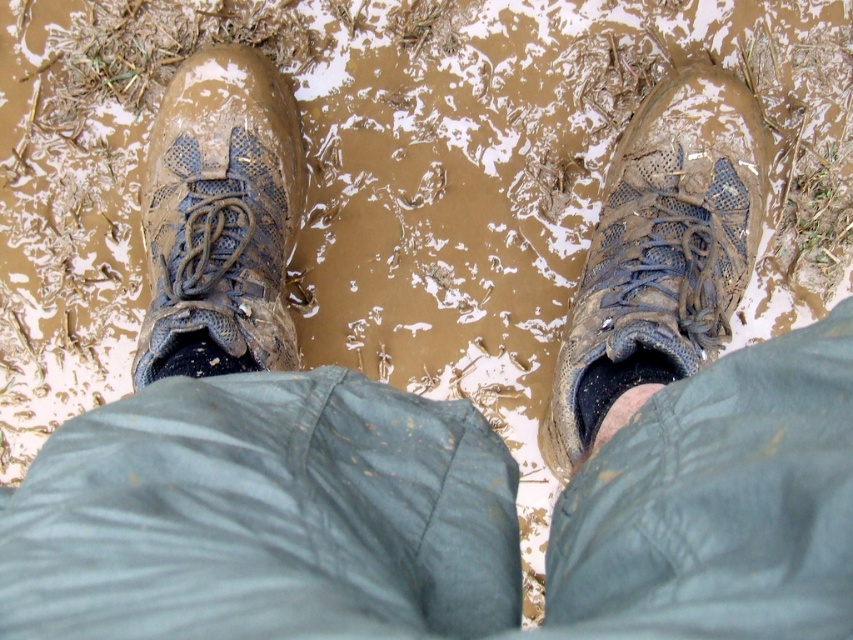
Can you confirm if muddy mesh boot at right is thinner than muddy textured boot at left?

No, muddy mesh boot at right is not thinner than muddy textured boot at left.

Describe the element at coordinates (662, 250) in the screenshot. This screenshot has width=853, height=640. I see `muddy mesh boot at right` at that location.

At what (x,y) coordinates should I click in order to perform the action: click on muddy mesh boot at right. Please return your answer as a coordinate pair (x, y). The width and height of the screenshot is (853, 640). Looking at the image, I should click on (662, 250).